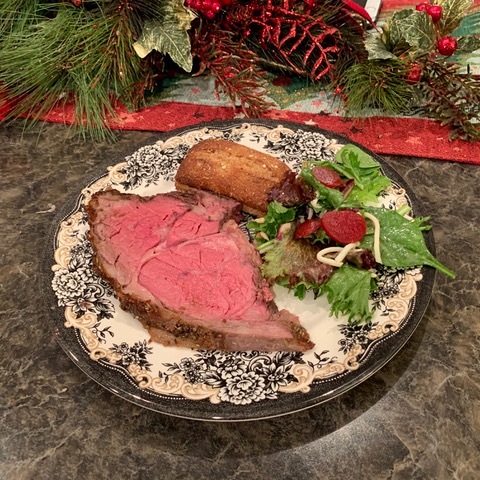
You are a GUI agent. You are given a task and a screenshot of the screen. Output one action in this format:
    pyautogui.click(x=<x>, y=<y>)
    Task: Click on the glass plate
    
    Given the screenshot: What is the action you would take?
    pyautogui.click(x=109, y=393)